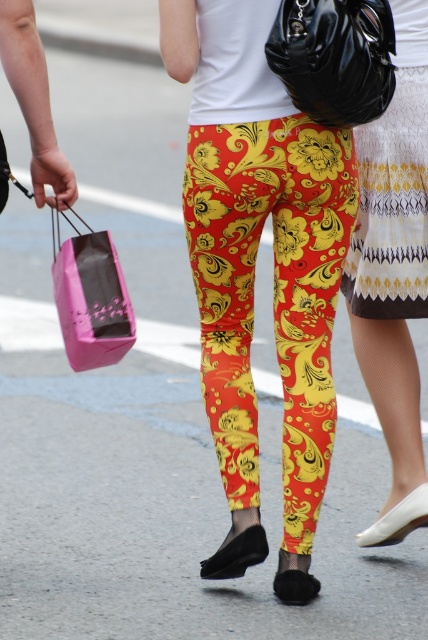
Question: Where is printed fabric skirt at center located in relation to pink paper shopping bag at left in the image?

Choices:
 (A) above
 (B) below

Answer: (A)

Question: Which object appears closest to the camera in this image?

Choices:
 (A) pink paper shopping bag at left
 (B) floral-patterned leggings at center

Answer: (B)

Question: Which point appears farthest from the camera in this image?

Choices:
 (A) (332, 58)
 (B) (216, 228)
 (C) (101, 346)
 (D) (360, 234)

Answer: (D)

Question: Can you confirm if floral-patterned leggings at center is wider than black leather handbag at upper center?

Choices:
 (A) no
 (B) yes

Answer: (B)

Question: Estimate the real-world distances between objects in this image. Which object is closer to the white textured dress at upper right?

Choices:
 (A) black leather handbag at upper center
 (B) pink paper shopping bag at left
 (C) printed fabric skirt at center

Answer: (C)

Question: Is white textured dress at upper right to the right of black leather handbag at upper center from the viewer's perspective?

Choices:
 (A) no
 (B) yes

Answer: (B)